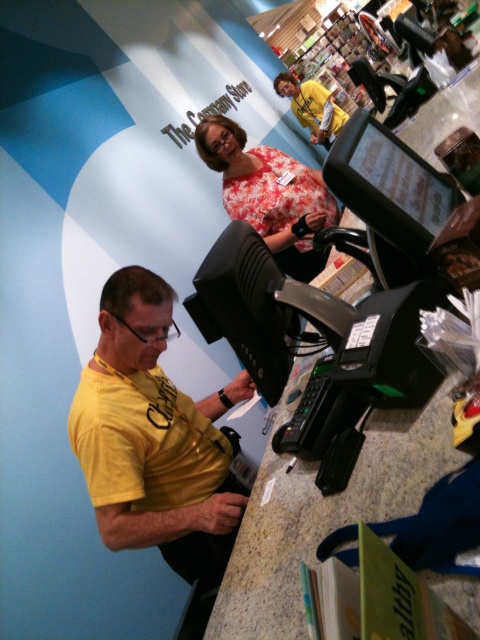
Question: Based on their relative distances, which object is nearer to the floral fabric blouse at center?

Choices:
 (A) yellow matte shirt at center
 (B) yellow matte shirt at upper center

Answer: (A)

Question: Is yellow matte shirt at center to the right of yellow matte shirt at upper center from the viewer's perspective?

Choices:
 (A) yes
 (B) no

Answer: (B)

Question: Which object is positioned closest to the yellow matte shirt at upper center?

Choices:
 (A) yellow matte shirt at center
 (B) floral fabric blouse at center

Answer: (B)

Question: Considering the relative positions of yellow matte shirt at center and yellow matte shirt at upper center in the image provided, where is yellow matte shirt at center located with respect to yellow matte shirt at upper center?

Choices:
 (A) below
 (B) above

Answer: (A)

Question: Does yellow matte shirt at center have a greater width compared to yellow matte shirt at upper center?

Choices:
 (A) no
 (B) yes

Answer: (A)

Question: Which object appears farthest from the camera in this image?

Choices:
 (A) floral fabric blouse at center
 (B) yellow matte shirt at center
 (C) yellow matte shirt at upper center

Answer: (C)